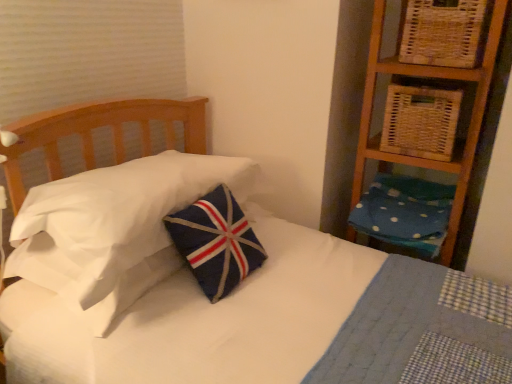
Question: Does woven natural basket at upper right, the second basket viewed from the top, have a greater height compared to blue dotted fabric pillow at right, the first pillow viewed from the right?

Choices:
 (A) yes
 (B) no

Answer: (A)

Question: Is woven natural basket at upper right, which is counted as the first basket, starting from the bottom, directly adjacent to blue dotted fabric pillow at right, acting as the 2th pillow starting from the left?

Choices:
 (A) no
 (B) yes

Answer: (A)

Question: Does woven natural basket at upper right, the second basket viewed from the top, appear on the left side of blue dotted fabric pillow at right, acting as the 2th pillow starting from the left?

Choices:
 (A) no
 (B) yes

Answer: (B)

Question: Is woven natural basket at upper right, the second basket viewed from the top, smaller than blue dotted fabric pillow at right, acting as the 2th pillow starting from the left?

Choices:
 (A) yes
 (B) no

Answer: (A)

Question: Is the position of woven natural basket at upper right, which is counted as the first basket, starting from the bottom, more distant than that of blue dotted fabric pillow at right, the first pillow viewed from the right?

Choices:
 (A) no
 (B) yes

Answer: (A)

Question: Considering the positions of point (429, 107) and point (429, 236), is point (429, 107) closer or farther from the camera than point (429, 236)?

Choices:
 (A) closer
 (B) farther

Answer: (A)

Question: Looking at their shapes, would you say woven natural basket at upper right, which is counted as the first basket, starting from the bottom, is wider or thinner than blue dotted fabric pillow at right, the first pillow viewed from the right?

Choices:
 (A) thin
 (B) wide

Answer: (A)

Question: From a real-world perspective, is woven natural basket at upper right, which is counted as the first basket, starting from the bottom, positioned above or below blue dotted fabric pillow at right, acting as the 2th pillow starting from the left?

Choices:
 (A) above
 (B) below

Answer: (A)

Question: From the image's perspective, relative to blue dotted fabric pillow at right, the first pillow viewed from the right, is woven natural basket at upper right, the second basket viewed from the top, above or below?

Choices:
 (A) above
 (B) below

Answer: (A)

Question: From the image's perspective, relative to woven wicker basket at upper right, marked as the second basket in a bottom-to-top arrangement, is woven natural basket at upper right, which is counted as the first basket, starting from the bottom, above or below?

Choices:
 (A) below
 (B) above

Answer: (A)

Question: Do you think woven natural basket at upper right, the second basket viewed from the top, is within woven wicker basket at upper right, the first basket viewed from the top, or outside of it?

Choices:
 (A) inside
 (B) outside

Answer: (B)

Question: Relative to woven wicker basket at upper right, marked as the second basket in a bottom-to-top arrangement, is woven natural basket at upper right, which is counted as the first basket, starting from the bottom, in front or behind?

Choices:
 (A) behind
 (B) front

Answer: (A)

Question: Considering the positions of woven natural basket at upper right, which is counted as the first basket, starting from the bottom, and woven wicker basket at upper right, the first basket viewed from the top, in the image, is woven natural basket at upper right, which is counted as the first basket, starting from the bottom, bigger or smaller than woven wicker basket at upper right, the first basket viewed from the top,?

Choices:
 (A) small
 (B) big

Answer: (B)

Question: From a real-world perspective, is navy felt pillow at center, the first pillow in the left-to-right sequence, above or below blue dotted fabric pillow at right, acting as the 2th pillow starting from the left?

Choices:
 (A) above
 (B) below

Answer: (A)

Question: Relative to blue dotted fabric pillow at right, the first pillow viewed from the right, is navy felt pillow at center, the first pillow in the left-to-right sequence, in front or behind?

Choices:
 (A) behind
 (B) front

Answer: (B)